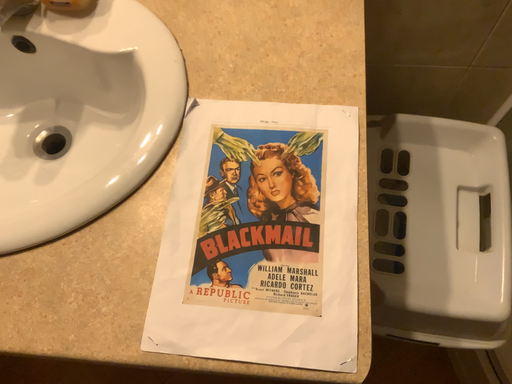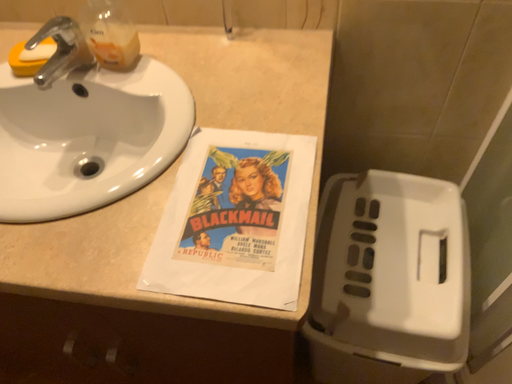
Question: Which way did the camera rotate in the video?

Choices:
 (A) rotated downward
 (B) rotated upward

Answer: (B)